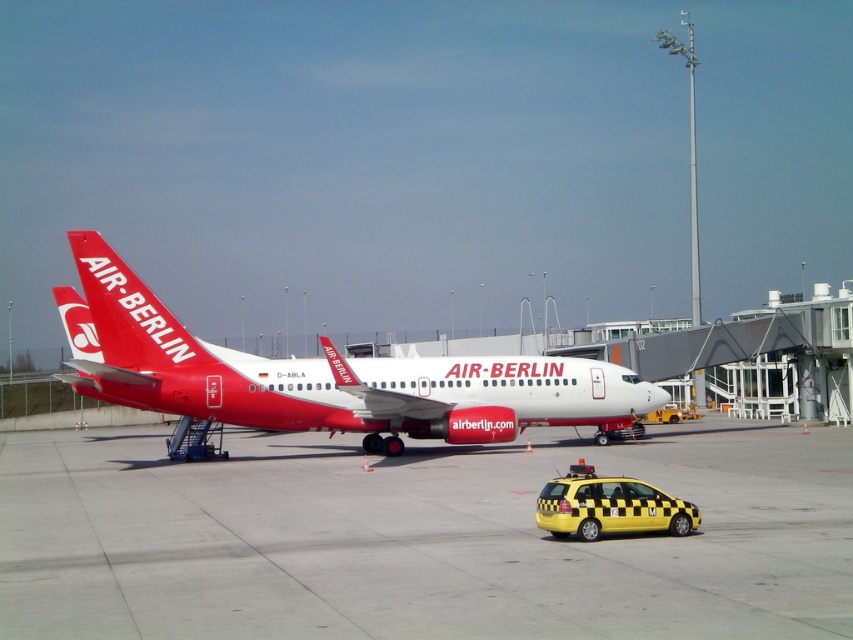
You are a ground crew member at the airport. You need to move the yellow checkered taxi at lower right to a parking spot that is only wide enough for vehicles narrower than the matte white airplane at center. Can the taxi fit into the parking spot?

The matte white airplane at center might be wider than the yellow checkered taxi at lower right, so there is a possibility that the taxi could fit into the parking spot if the airplane is indeed wider. However, without exact measurements, it is uncertain. The crew should verify the width of both the airplane and the taxi before deciding.

You are standing at the camera position and want to reach the two points marked on the image. Which point, point (x=109, y=600) or point (x=646, y=397), will you reach first if you move directly towards them?

Point (x=109, y=600) is closer to the camera than point (x=646, y=397), so you will reach point (x=109, y=600) first.

You are standing at the airport gate where the Air Berlin aircraft is parked. You see a point marked at coordinates [418,538]. What type of surface is located at that point?

The point at coordinates [418,538] marks smooth concrete tarmac at center.